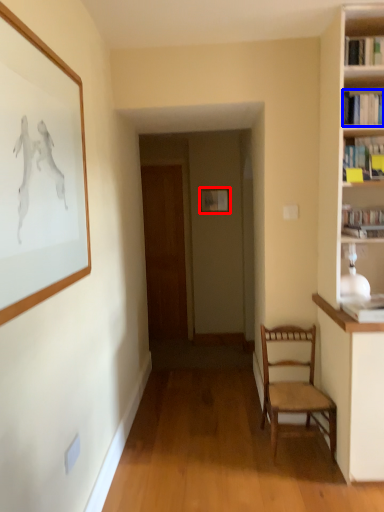
Question: Among these objects, which one is farthest to the camera, picture frame (highlighted by a red box) or book (highlighted by a blue box)?

Choices:
 (A) picture frame
 (B) book

Answer: (A)